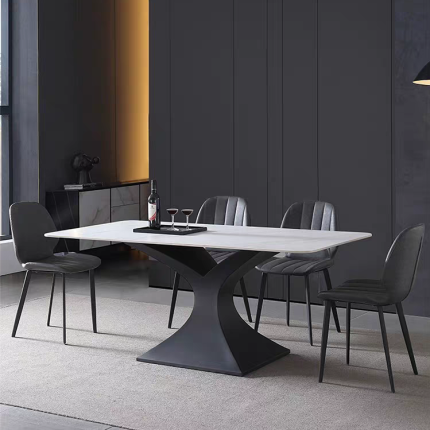
This screenshot has width=430, height=430. I want to click on chair, so click(x=33, y=220), click(x=223, y=208), click(x=308, y=214), click(x=403, y=257).